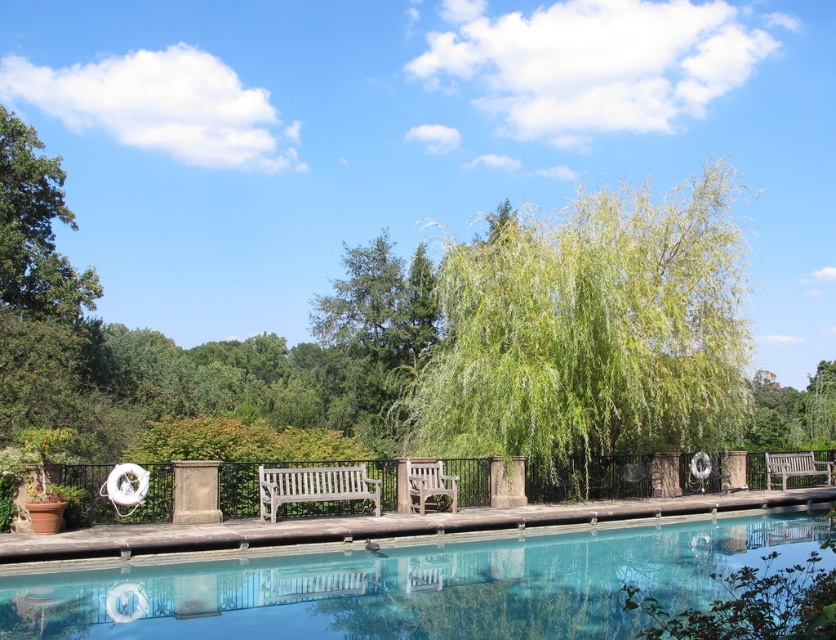
You are a maintenance worker who needs to place a 1.2 meter tall decoration on the clear glass pool at center or the white wood bench at center. Based on their heights, which location would be more appropriate?

The clear glass pool at center has a greater height compared to the white wood bench at center. Therefore, placing the 1.2 meter tall decoration on the clear glass pool at center would be more appropriate as it can accommodate the height better.

You are a maintenance worker needing to check both benches. Starting from the wooden park bench at center, which direction should you move to reach the light brown wooden bench at right?

Since the wooden park bench at center is located above the light brown wooden bench at right, you should move downward to reach the light brown wooden bench at right.

You are standing at the point marked as point (410, 586) in the image. What object are you currently standing on?

You are standing on the clear glass pool at center located at point (410, 586).